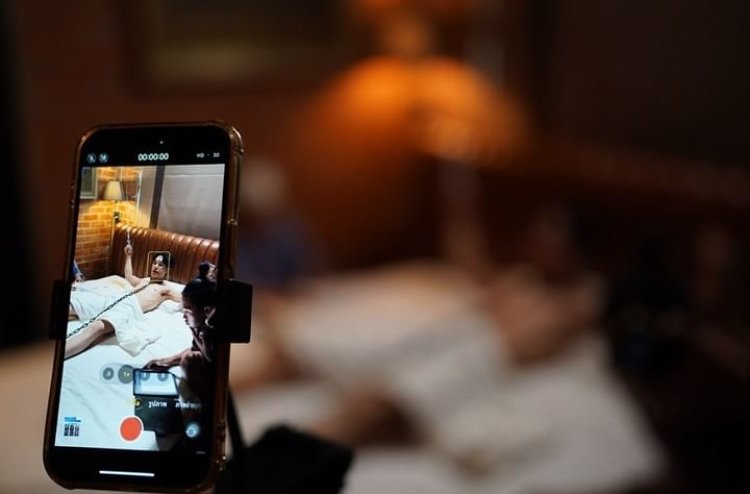
What are the coordinates of `framed wall art` in the screenshot? It's located at (85, 178).